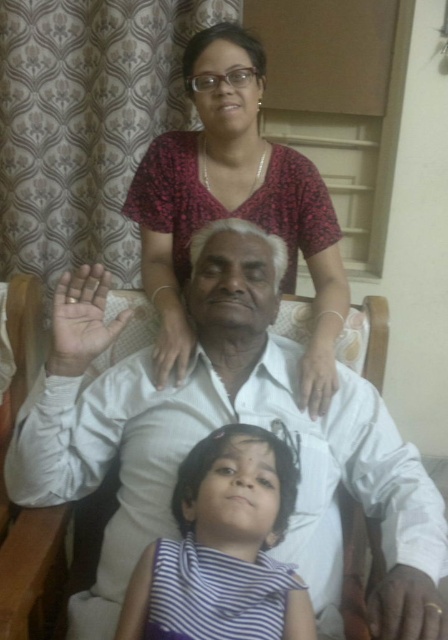
Question: Is white smooth shirt at center to the right of striped fabric at lower center from the viewer's perspective?

Choices:
 (A) yes
 (B) no

Answer: (A)

Question: Which of these objects is positioned closest to the matte floral blouse at upper center?

Choices:
 (A) white smooth shirt at center
 (B) striped fabric at lower center

Answer: (A)

Question: Can you confirm if white smooth shirt at center is thinner than matte floral blouse at upper center?

Choices:
 (A) yes
 (B) no

Answer: (B)

Question: Among these objects, which one is nearest to the camera?

Choices:
 (A) white smooth shirt at center
 (B) striped fabric at lower center
 (C) matte floral blouse at upper center

Answer: (A)

Question: Does white smooth shirt at center have a lesser width compared to striped fabric at lower center?

Choices:
 (A) no
 (B) yes

Answer: (A)

Question: Which of these objects is positioned closest to the striped fabric at lower center?

Choices:
 (A) matte floral blouse at upper center
 (B) white smooth shirt at center

Answer: (B)